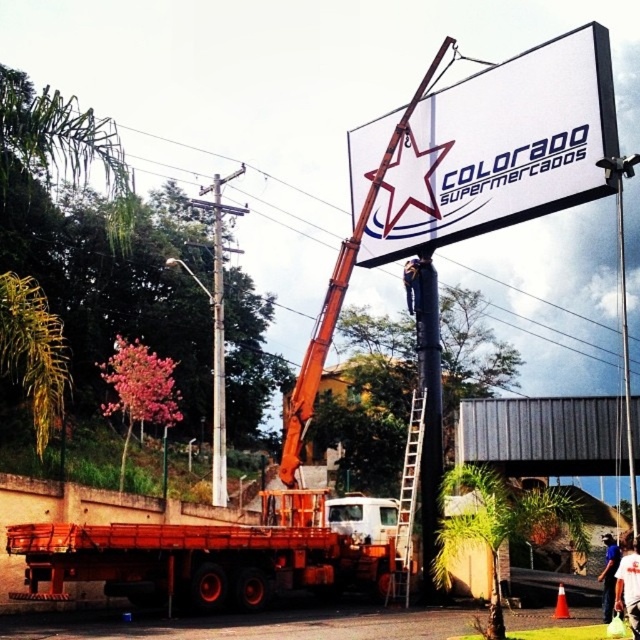
You are a safety inspector checking the billboard installation. You need to ensure that the white matte sign at upper center and the brushed metal pole at upper center are positioned safely. Based on their sizes, which object should you be more cautious about in terms of stability?

The white matte sign at upper center has a larger width than the brushed metal pole at upper center, so it may be less stable and requires more caution during installation.

You are a safety inspector checking the installation site. You notice the metallic ladder at center and the white hard hat at center. Which object is taller?

The metallic ladder at center is much taller than the white hard hat at center.

You are a safety inspector on the construction site. You need to ensure that the metallic ladder at center is placed at least 50 feet away from the white hard hat at center for safety regulations. Based on the scene, is the current placement compliant with the safety requirement?

The distance between the metallic ladder at center and the white hard hat at center is 43.93 feet, which is less than the required 50 feet. Therefore, the current placement does not comply with the safety regulations.